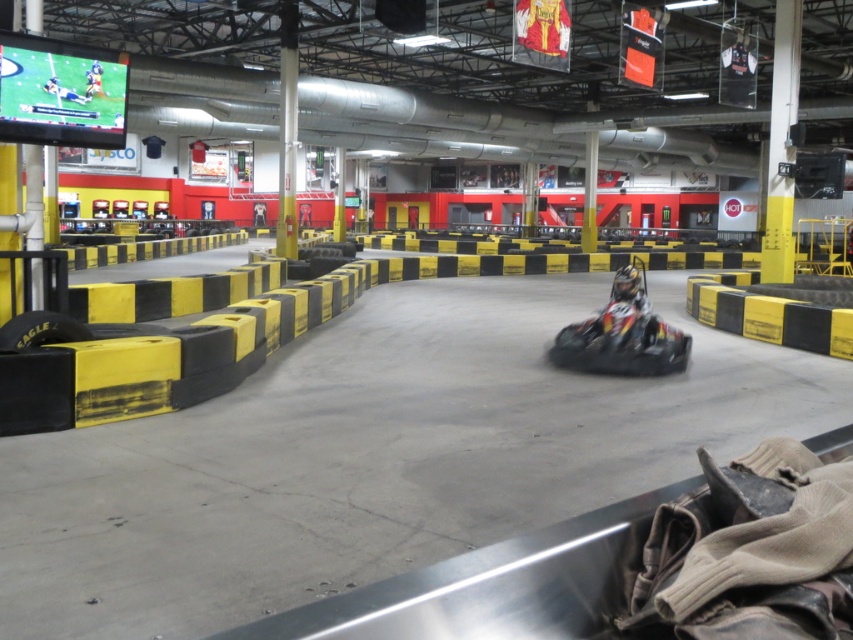
Describe the element at coordinates (630, 308) in the screenshot. I see `shiny black helmet at center` at that location.

I want to click on shiny black helmet at center, so pyautogui.click(x=630, y=308).